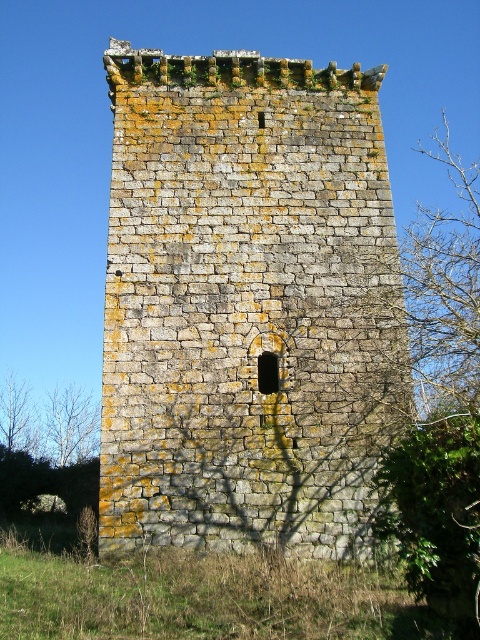
Based on the photo, which is above, bare branches at left or brown leafy tree at lower left?

brown leafy tree at lower left is higher up.

Does point (79, 442) come closer to viewer compared to point (8, 381)?

Yes, point (79, 442) is in front of point (8, 381).

Which is in front, point (63, 392) or point (26, 440)?

Positioned in front is point (26, 440).

Locate an element on the screen. Image resolution: width=480 pixels, height=640 pixels. bare branches at left is located at coordinates (70, 426).

Is weathered stone tower at center shorter than brown leafy tree at lower left?

No.

Which of these two, weathered stone tower at center or brown leafy tree at lower left, stands taller?

With more height is weathered stone tower at center.

Which is behind, point (146, 54) or point (34, 420)?

The point (34, 420) is more distant.

Identify the location of weathered stone tower at center. (248, 305).

Between weathered stone tower at center and bare branches at left, which one appears on the left side from the viewer's perspective?

From the viewer's perspective, bare branches at left appears more on the left side.

Between point (169, 209) and point (48, 456), which one is positioned behind?

Point (48, 456)

Identify the location of weathered stone tower at center. Image resolution: width=480 pixels, height=640 pixels. point(248,305).